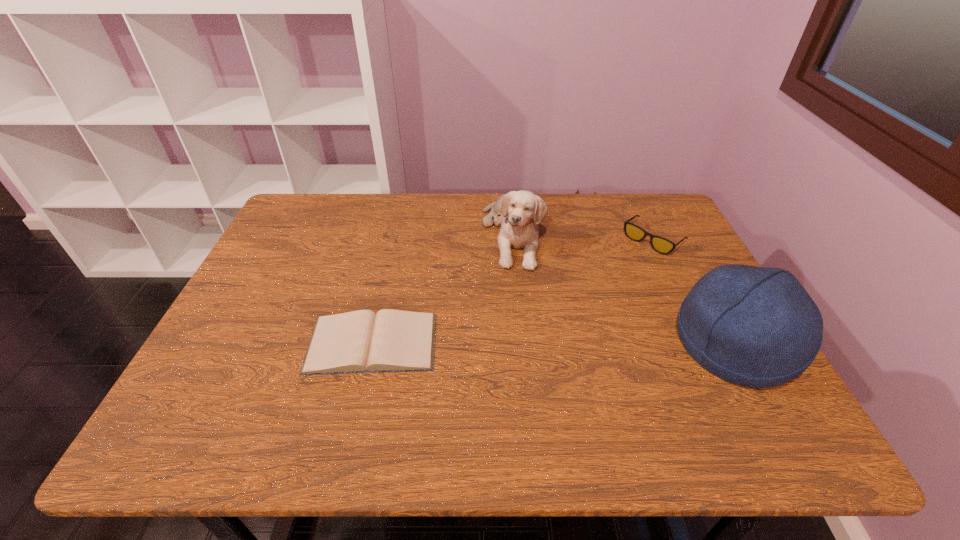
In order to click on object situated at the far right corner in this screenshot , I will do `click(661, 245)`.

This screenshot has height=540, width=960. I want to click on object situated at the near right corner, so click(x=757, y=327).

Identify the location of free spot at the far edge of the desktop. This screenshot has height=540, width=960. (551, 234).

In the image, there is a desktop. In order to click on free space at the near edge in this screenshot , I will do `click(440, 376)`.

Find the location of a particular element. Image resolution: width=960 pixels, height=540 pixels. free space at the left edge of the desktop is located at coordinates (217, 347).

The height and width of the screenshot is (540, 960). In the image, there is a desktop. In order to click on free space at the near left corner in this screenshot , I will do `click(229, 381)`.

I want to click on free space at the near right corner of the desktop, so click(x=760, y=402).

This screenshot has width=960, height=540. In order to click on vacant area that lies between the second tallest object and the leftmost object in this screenshot , I will do `click(442, 288)`.

Locate an element on the screen. free point between the shortest object and the third tallest object is located at coordinates coord(513,291).

You are a GUI agent. You are given a task and a screenshot of the screen. Output one action in this format:
    pyautogui.click(x=<x>, y=<y>)
    Task: Click on the vacant space in between the second object from left to right and the leftmost object
    This screenshot has width=960, height=540.
    Given the screenshot: What is the action you would take?
    pyautogui.click(x=442, y=288)